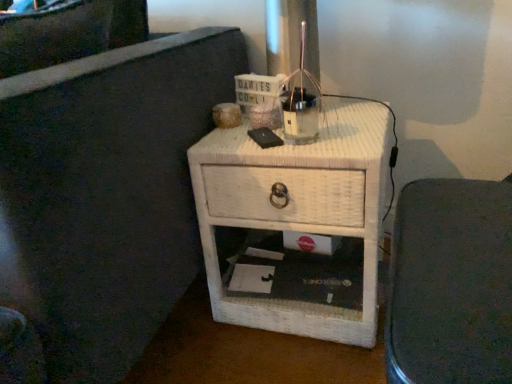
Question: Would you say white wicker nightstand at center is inside or outside white wicker nightstand at center?

Choices:
 (A) inside
 (B) outside

Answer: (B)

Question: In the image, is white wicker nightstand at center on the left side or the right side of white wicker nightstand at center?

Choices:
 (A) right
 (B) left

Answer: (A)

Question: In terms of width, does white wicker nightstand at center look wider or thinner when compared to white wicker nightstand at center?

Choices:
 (A) wide
 (B) thin

Answer: (B)

Question: In terms of height, does white wicker nightstand at center look taller or shorter compared to white wicker nightstand at center?

Choices:
 (A) tall
 (B) short

Answer: (B)

Question: Which is correct: white wicker nightstand at center is inside white wicker nightstand at center, or outside of it?

Choices:
 (A) inside
 (B) outside

Answer: (B)

Question: In the image, is white wicker nightstand at center positioned in front of or behind white wicker nightstand at center?

Choices:
 (A) behind
 (B) front

Answer: (A)

Question: In terms of size, does white wicker nightstand at center appear bigger or smaller than white wicker nightstand at center?

Choices:
 (A) big
 (B) small

Answer: (A)